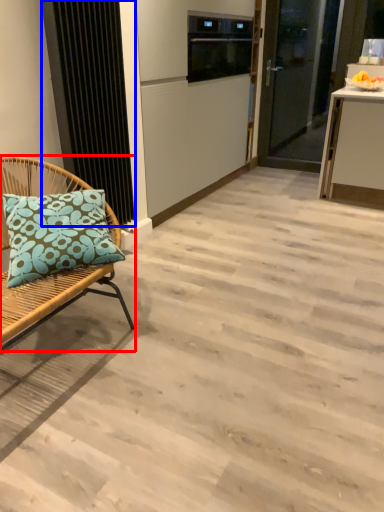
Question: Which point is further to the camera, chair (highlighted by a red box) or radiator (highlighted by a blue box)?

Choices:
 (A) chair
 (B) radiator

Answer: (B)